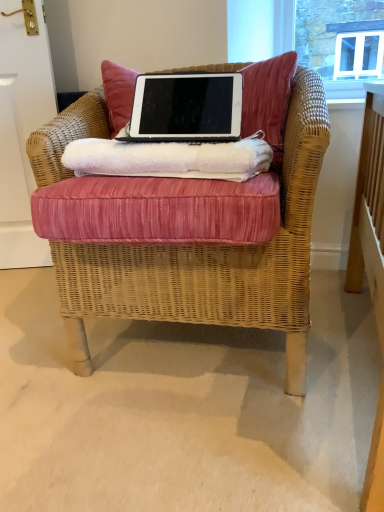
Question: Considering the positions of black matte laptop at center and velvet cushion at upper center in the image, is black matte laptop at center bigger or smaller than velvet cushion at upper center?

Choices:
 (A) big
 (B) small

Answer: (B)

Question: Looking at their shapes, would you say black matte laptop at center is wider or thinner than velvet cushion at upper center?

Choices:
 (A) wide
 (B) thin

Answer: (B)

Question: Based on their relative distances, which object is farther from the pink fabric cushion at center?

Choices:
 (A) black matte laptop at center
 (B) white fluffy towel at center
 (C) woven wicker chair at center
 (D) velvet cushion at upper center

Answer: (D)

Question: Estimate the real-world distances between objects in this image. Which object is farther from the pink fabric cushion at center?

Choices:
 (A) white fluffy towel at center
 (B) black matte laptop at center
 (C) velvet cushion at upper center
 (D) woven wicker chair at center

Answer: (C)